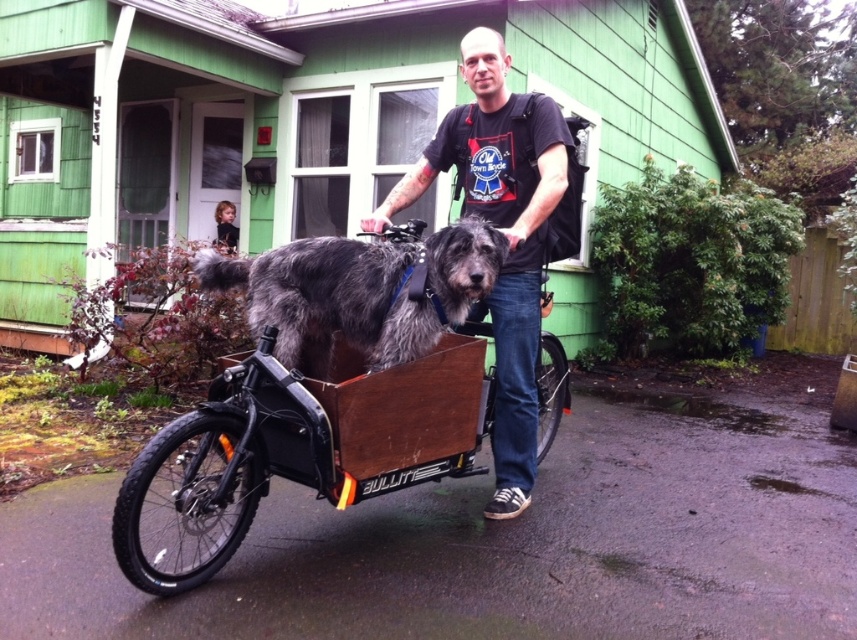
Is matte black t-shirt at center to the right of wooden box at center from the viewer's perspective?

No, matte black t-shirt at center is not to the right of wooden box at center.

Who is positioned more to the left, matte black t-shirt at center or wooden box at center?

matte black t-shirt at center

Where is `matte black t-shirt at center`? The image size is (857, 640). matte black t-shirt at center is located at coordinates (502, 232).

Identify the location of matte black t-shirt at center. (502, 232).

Is matte black t-shirt at center positioned at the back of gray woolen dog at center?

Yes, it is behind gray woolen dog at center.

Between point (502, 484) and point (381, 305), which one is positioned behind?

The point (502, 484) is behind.

This screenshot has width=857, height=640. I want to click on matte black t-shirt at center, so click(502, 232).

Between gray woolen dog at center and wooden box at center, which one is positioned lower?

wooden box at center is lower down.

Does gray woolen dog at center have a larger size compared to wooden box at center?

Indeed, gray woolen dog at center has a larger size compared to wooden box at center.

I want to click on gray woolen dog at center, so click(x=360, y=292).